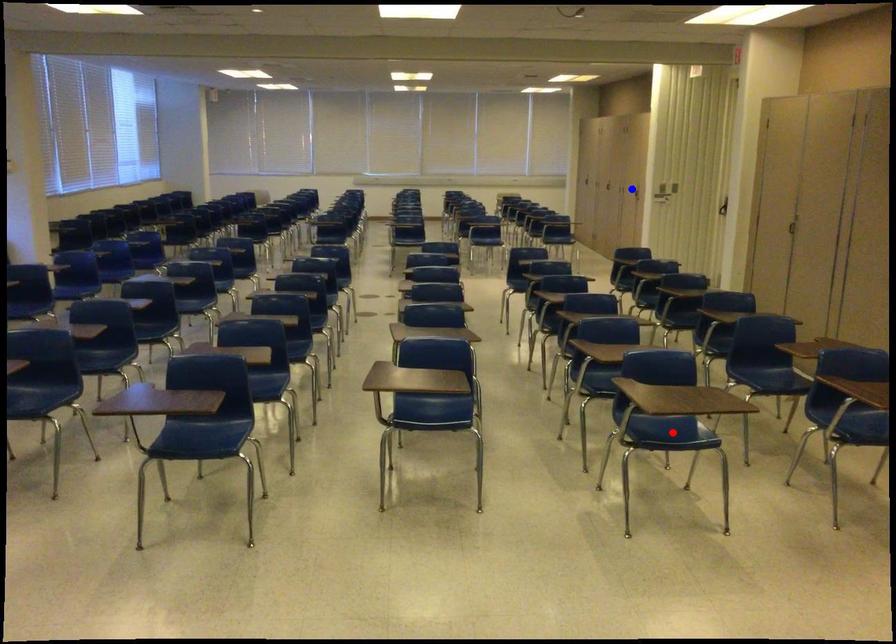
Question: Which of the two points in the image is closer to the camera?

Choices:
 (A) Blue point is closer.
 (B) Red point is closer.

Answer: (B)